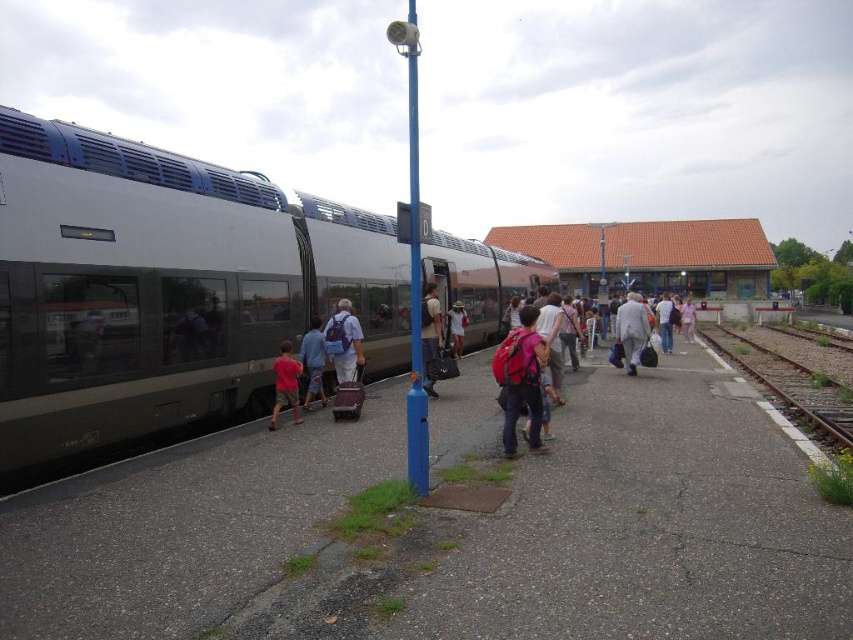
You are a passenger who just got off the train and see the white cloth bag at center and the pink fabric dress at center on the platform. Which item is taller?

The white cloth bag at center is taller than the pink fabric dress at center.